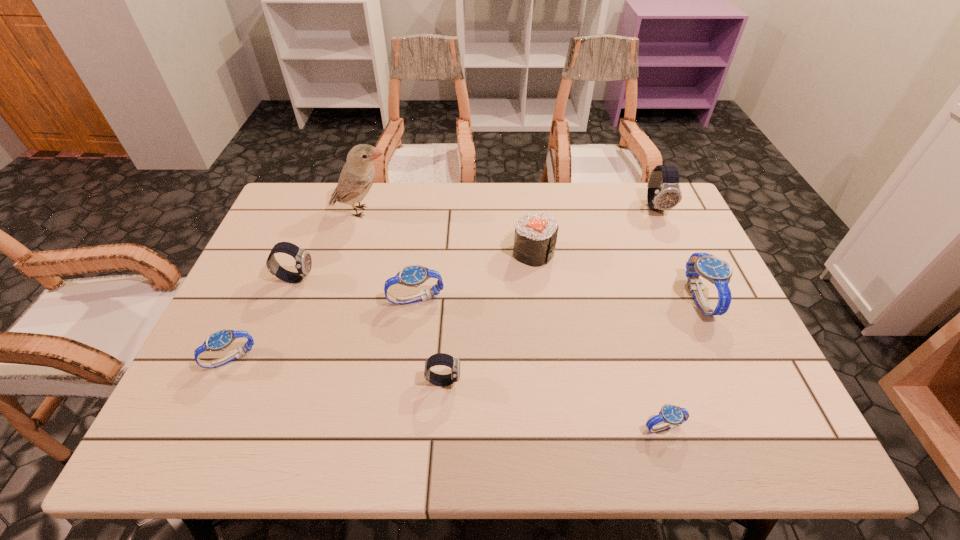
The width and height of the screenshot is (960, 540). What are the coordinates of `vacant position located on the left of the biggest blue watch` in the screenshot? It's located at (607, 298).

Locate an element on the screen. The image size is (960, 540). vacant space located on the front of the third blue watch from right to left is located at coordinates (407, 363).

What are the coordinates of `vacant area located on the face of the nearest dark watch` in the screenshot? It's located at (608, 381).

The width and height of the screenshot is (960, 540). In order to click on vacant space positioned on the right of the leftmost blue watch in this screenshot , I will do `click(388, 359)`.

Where is `free space located 0.090m on the back of the shortest watch`? free space located 0.090m on the back of the shortest watch is located at coordinates (649, 379).

Where is `bird at the far edge`? This screenshot has width=960, height=540. bird at the far edge is located at coordinates (357, 176).

The width and height of the screenshot is (960, 540). In order to click on watch at the far edge in this screenshot , I will do `click(663, 193)`.

What are the coordinates of `object that is positioned at the near edge` in the screenshot? It's located at (670, 415).

In order to click on bird that is at the left edge in this screenshot , I will do `click(357, 176)`.

The image size is (960, 540). What are the coordinates of `object present at the far left corner` in the screenshot? It's located at (357, 176).